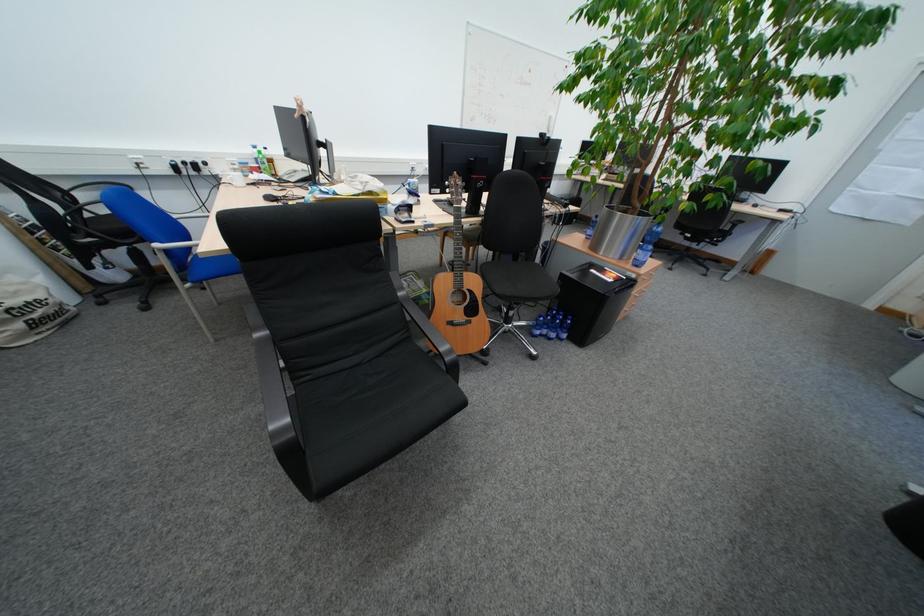
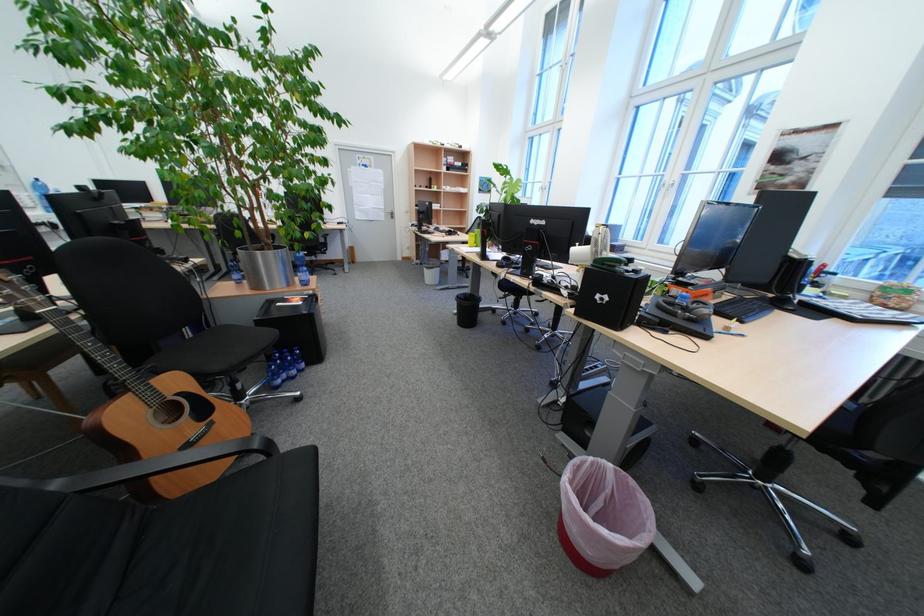
Find the pixel in the second image that matches [411,294] in the first image.

(67, 485)